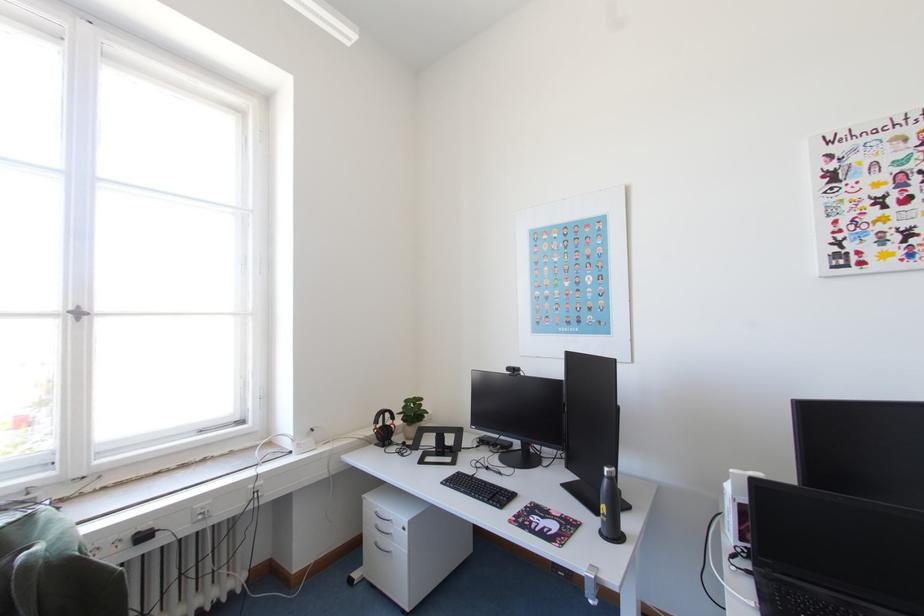
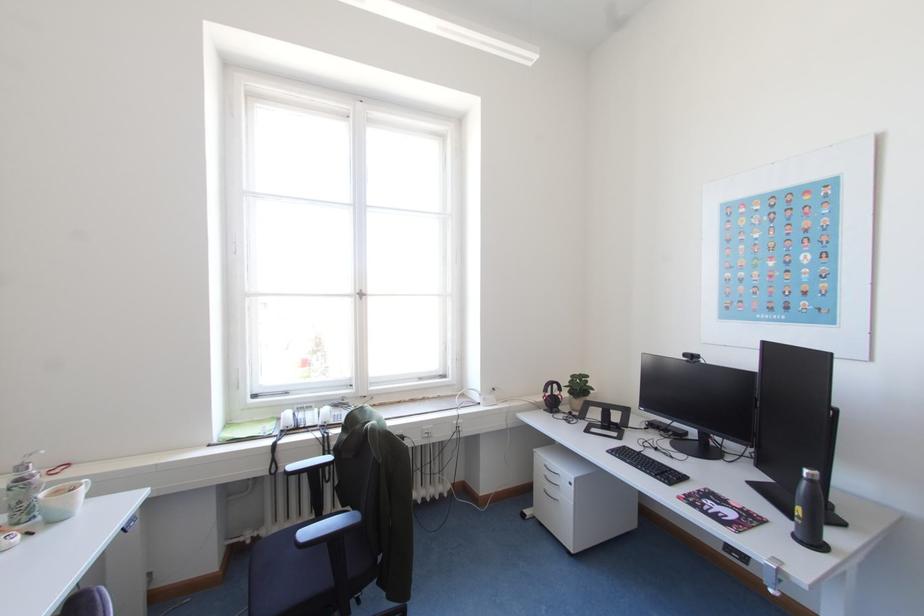
Question: The camera is either moving clockwise (left) or counter-clockwise (right) around the object. The first image is from the beginning of the video and the second image is from the end. Is the camera moving left or right when shooting the video?

Choices:
 (A) Left
 (B) Right

Answer: (B)